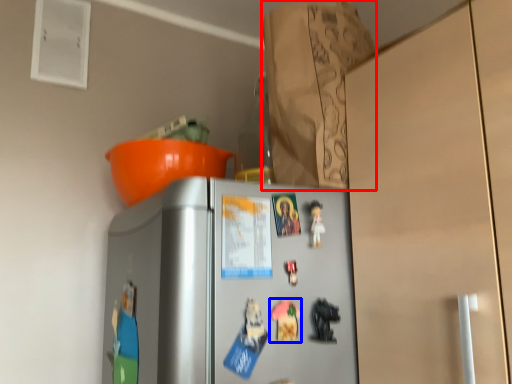
Question: Which object is closer to the camera taking this photo, paper bag (highlighted by a red box) or toy (highlighted by a blue box)?

Choices:
 (A) paper bag
 (B) toy

Answer: (B)